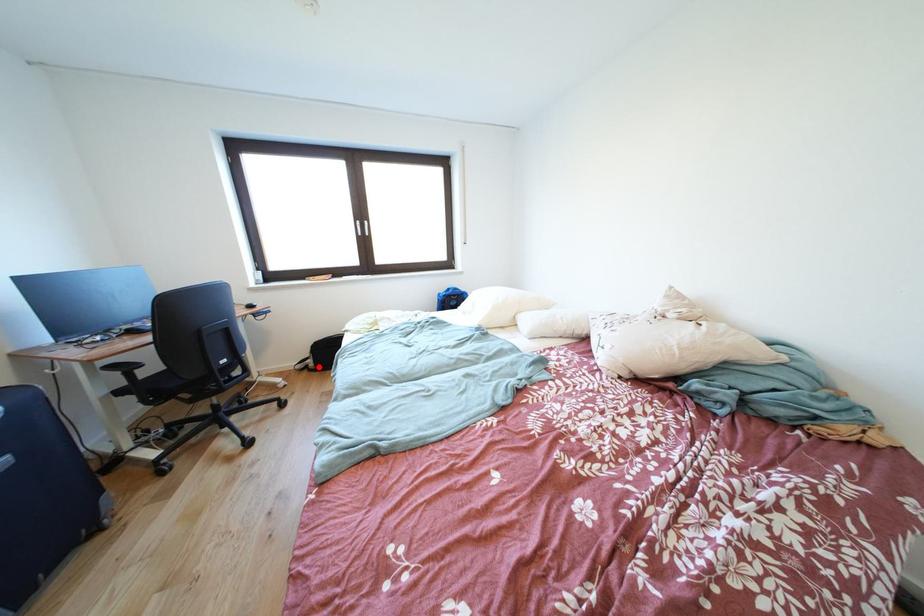
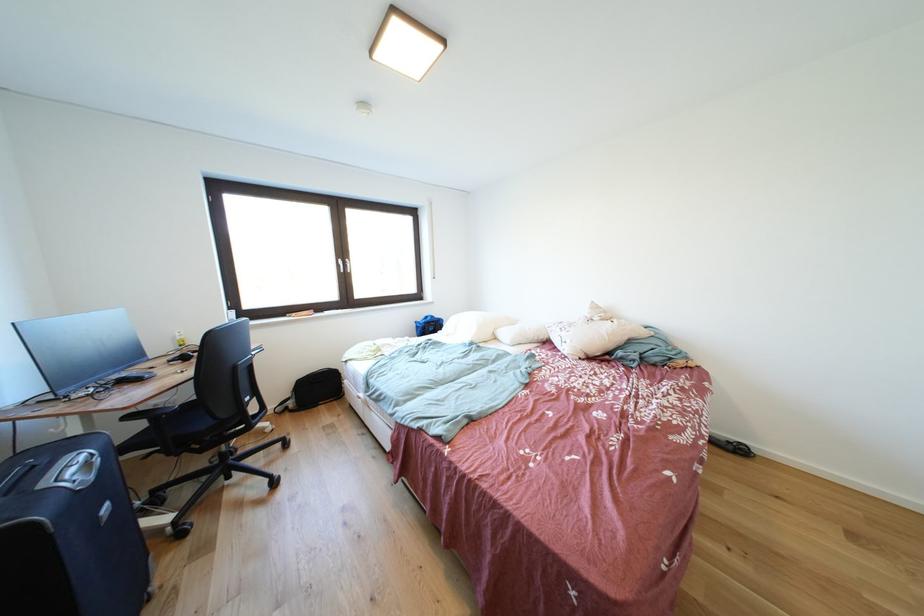
Question: I am providing you with two images of the same scene from different viewpoints. Given a red point in image1, look at the same physical point in image2. Is it:

Choices:
 (A) Closer to the viewpoint
 (B) Farther from the viewpoint

Answer: (A)